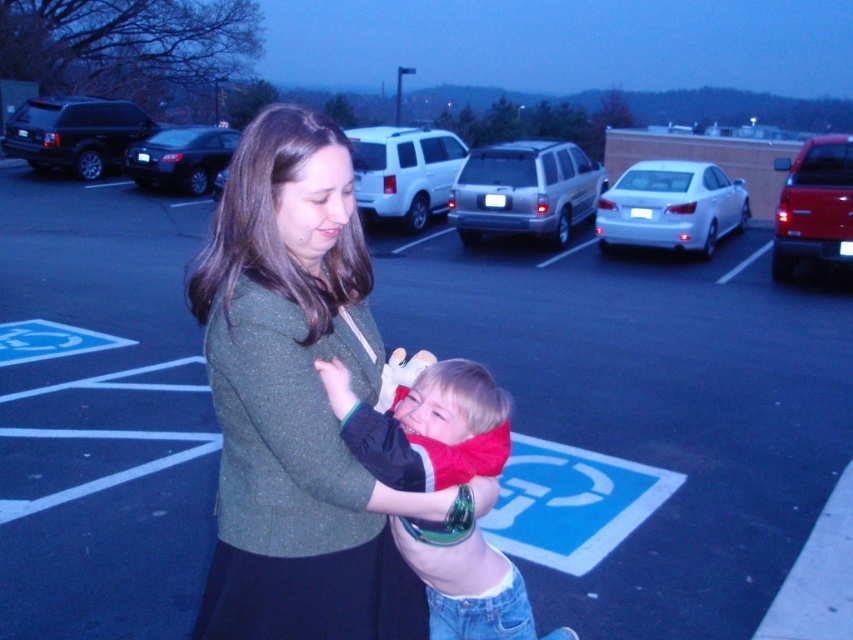
Question: Can you confirm if white glossy sedan at center is wider than white matte suv at center?

Choices:
 (A) yes
 (B) no

Answer: (B)

Question: Among these points, which one is nearest to the camera?

Choices:
 (A) (300, 580)
 (B) (686, 244)
 (C) (805, 218)

Answer: (A)

Question: Which of the following is the farthest from the observer?

Choices:
 (A) (630, 225)
 (B) (128, 131)
 (C) (218, 252)
 (D) (160, 182)

Answer: (B)

Question: Which point is farther to the camera?

Choices:
 (A) (381, 132)
 (B) (231, 454)
 (C) (82, 157)

Answer: (C)

Question: Does satin silver suv at center appear on the right side of white glossy sedan at center?

Choices:
 (A) no
 (B) yes

Answer: (B)

Question: Can you confirm if red fleece jacket at center is bigger than shiny black sedan at center?

Choices:
 (A) yes
 (B) no

Answer: (B)